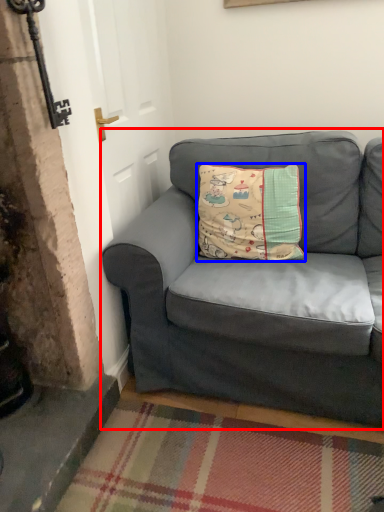
Question: Which of the following is the closest to the observer, studio couch (highlighted by a red box) or pillow (highlighted by a blue box)?

Choices:
 (A) studio couch
 (B) pillow

Answer: (A)